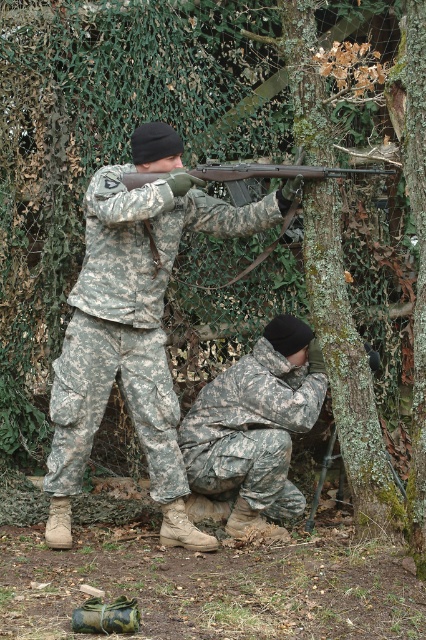
Which is above, camouflage fabric uniform at upper center or camouflage fabric uniform at lower center?

Positioned higher is camouflage fabric uniform at upper center.

Does point (83, 422) come farther from viewer compared to point (281, 428)?

No, it is not.

The image size is (426, 640). I want to click on camouflage fabric uniform at upper center, so click(x=129, y=323).

Is camouflage fabric uniform at upper center shorter than matte black shotgun at center?

In fact, camouflage fabric uniform at upper center may be taller than matte black shotgun at center.

Between camouflage fabric uniform at upper center and matte black shotgun at center, which one has less height?

matte black shotgun at center is shorter.

Locate an element on the screen. This screenshot has width=426, height=640. camouflage fabric uniform at upper center is located at coordinates (129, 323).

Identify the location of camouflage fabric uniform at upper center. (129, 323).

Is point (239, 360) less distant than point (262, 177)?

No.

Who is positioned more to the left, camouflage fabric uniform at lower center or matte black shotgun at center?

camouflage fabric uniform at lower center is more to the left.

Which is in front, point (245, 381) or point (195, 173)?

Point (195, 173) is more forward.

Where is `camouflage fabric uniform at lower center`? camouflage fabric uniform at lower center is located at coordinates (252, 429).